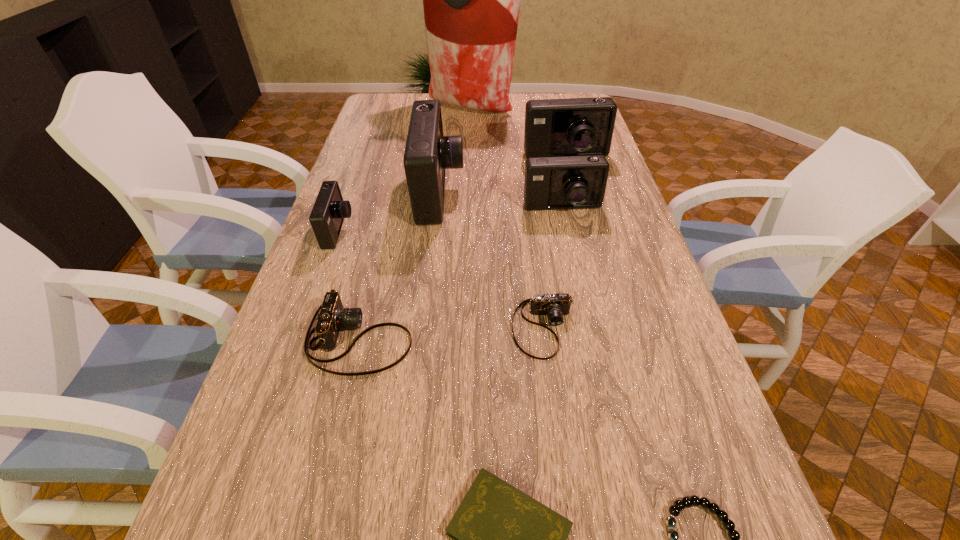
Where is `the farthest object`? the farthest object is located at coordinates (471, 0).

You are a GUI agent. You are given a task and a screenshot of the screen. Output one action in this format:
    pyautogui.click(x=<x>, y=<y>)
    Task: Click on the grocery bag
    The image size is (960, 540).
    Given the screenshot: What is the action you would take?
    pyautogui.click(x=471, y=0)

This screenshot has width=960, height=540. Find the location of `the third blue camera from right to left`. the third blue camera from right to left is located at coordinates (428, 153).

Where is `the eighth shortest object`? Image resolution: width=960 pixels, height=540 pixels. the eighth shortest object is located at coordinates (428, 153).

This screenshot has width=960, height=540. I want to click on the third smallest blue camera, so click(574, 126).

Identify the location of the fifth shortest camera. This screenshot has height=540, width=960. (574, 126).

Locate an element on the screen. This screenshot has height=540, width=960. the sixth shortest object is located at coordinates (573, 182).

Image resolution: width=960 pixels, height=540 pixels. What are the coordinates of `the third tallest camera` in the screenshot? It's located at (573, 182).

The height and width of the screenshot is (540, 960). I want to click on the third shortest camera, so click(329, 210).

At what (x,y) coordinates should I click in order to perform the action: click on the leftmost blue camera. Please return your answer as a coordinate pair (x, y). The image size is (960, 540). Looking at the image, I should click on (329, 210).